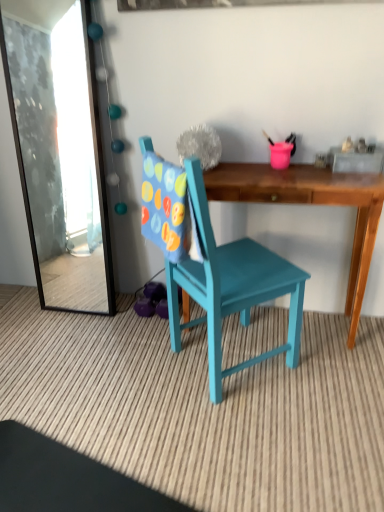
Find the location of a particular element. free space in front of teal painted wood chair at center is located at coordinates (242, 440).